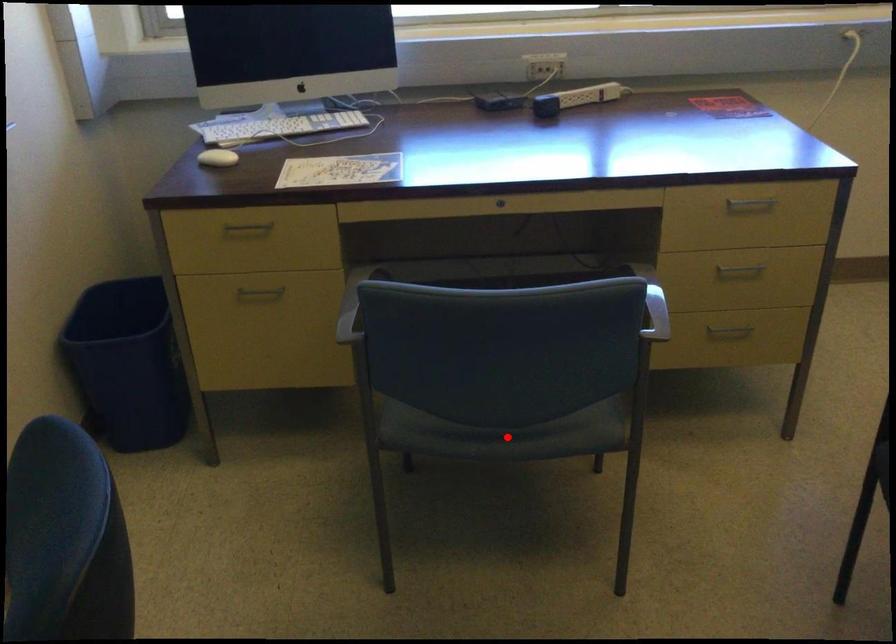
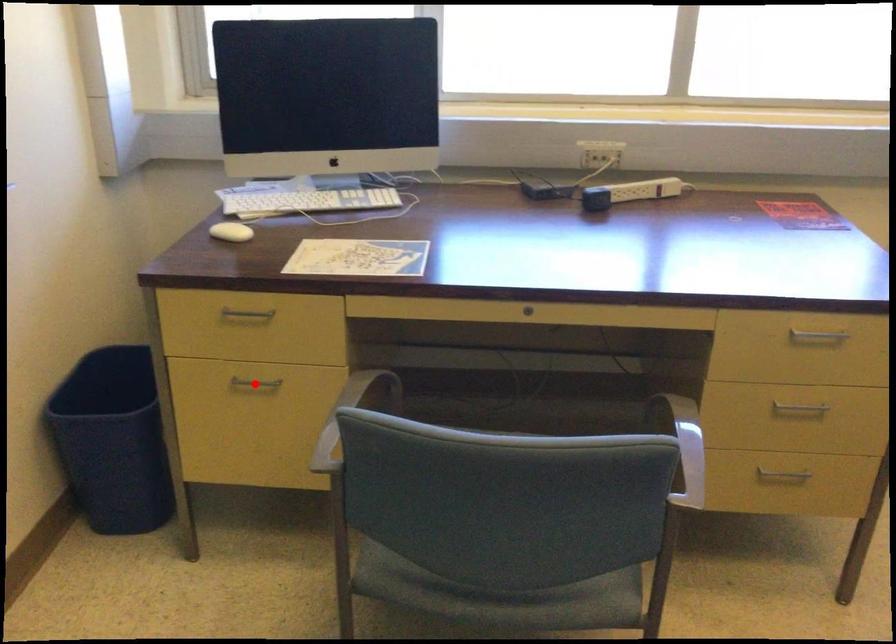
Based on the photo, I am providing you with two images of the same scene from different viewpoints. A red point is marked on the first image and another point is marked on the second image. Is the marked point in image1 the same physical position as the marked point in image2?

No